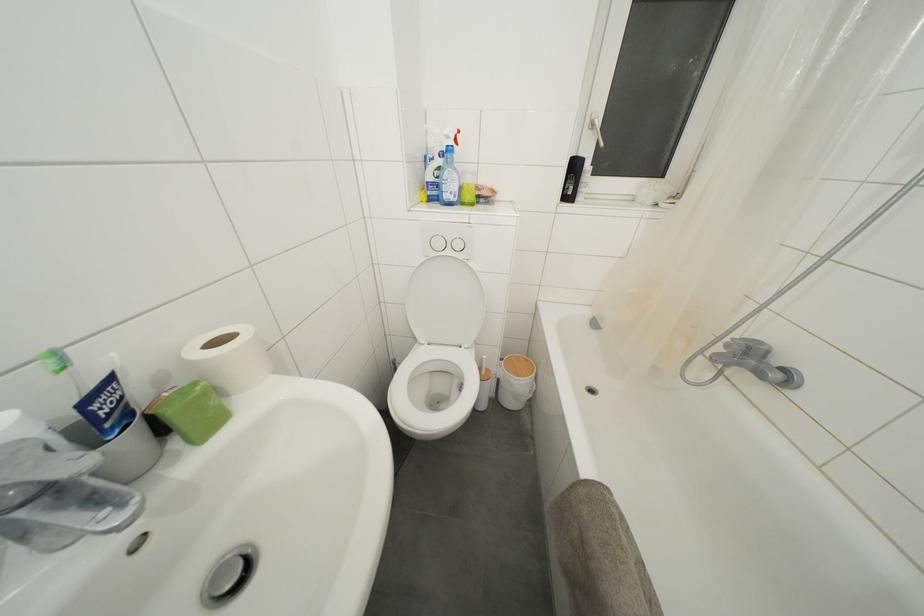
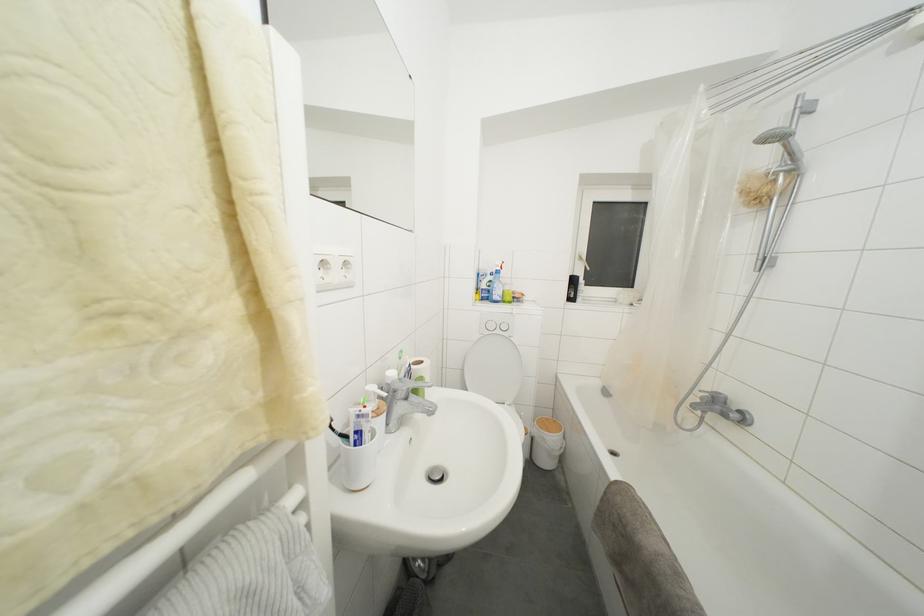
Locate, in the second image, the point that corresponds to point (578, 172) in the first image.

(578, 286)